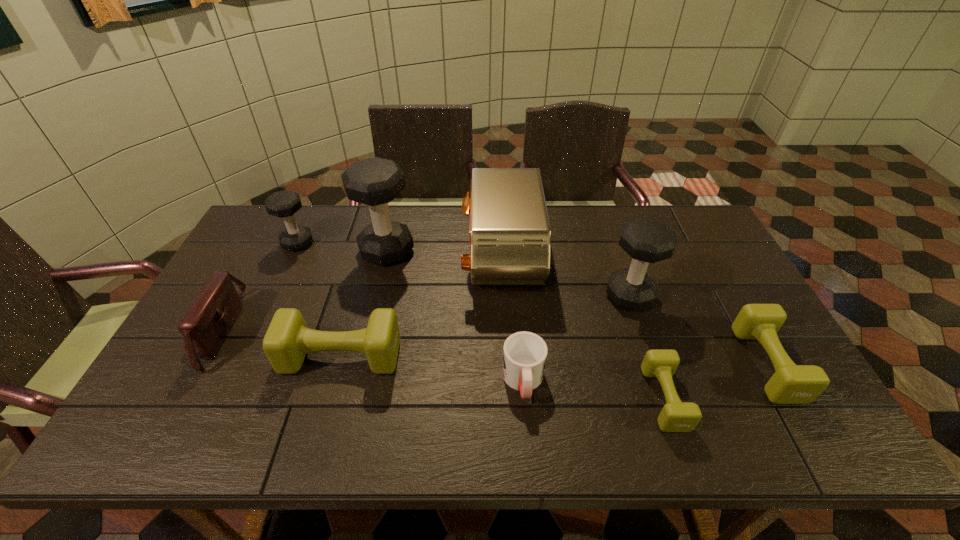
At what (x,y) coordinates should I click in order to perform the action: click on vacant area between the shoulder bag and the shortest object. Please return your answer as a coordinate pair (x, y). The image size is (960, 540). Looking at the image, I should click on (441, 364).

You are a GUI agent. You are given a task and a screenshot of the screen. Output one action in this format:
    pyautogui.click(x=<x>, y=<y>)
    Task: Click on the unoccupied position between the mug and the white toaster oven
    This screenshot has height=540, width=960.
    Given the screenshot: What is the action you would take?
    pyautogui.click(x=513, y=320)

Identify the location of free space between the shortest dumbbell and the second gray dumbbell from right to left. The image size is (960, 540). (526, 325).

Locate an element on the screen. The image size is (960, 540). the closest object to the smallest gray dumbbell is located at coordinates (375, 181).

Select which object is the fourth closest to the rightmost olive dumbbell. Please provide its 2D coordinates. Your answer should be formatted as a tuple, i.e. [(x, y)], where the tuple contains the x and y coordinates of a point satisfying the conditions above.

[(524, 354)]

You are a GUI agent. You are given a task and a screenshot of the screen. Output one action in this format:
    pyautogui.click(x=<x>, y=<y>)
    Task: Click on the dumbbell identified as the third closest to the rightmost olive dumbbell
    The image size is (960, 540).
    Given the screenshot: What is the action you would take?
    pyautogui.click(x=287, y=341)

Find the location of `dumbbell that is the second closest to the white toaster oven`. dumbbell that is the second closest to the white toaster oven is located at coordinates (647, 241).

Identify which gray dumbbell is located as the second nearest to the second shortest dumbbell. Please provide its 2D coordinates. Your answer should be formatted as a tuple, i.e. [(x, y)], where the tuple contains the x and y coordinates of a point satisfying the conditions above.

[(375, 181)]

Identify which gray dumbbell is the third closest to the second olive dumbbell from right to left. Please provide its 2D coordinates. Your answer should be formatted as a tuple, i.e. [(x, y)], where the tuple contains the x and y coordinates of a point satisfying the conditions above.

[(283, 204)]

The image size is (960, 540). I want to click on the second closest olive dumbbell to the mug, so click(x=287, y=341).